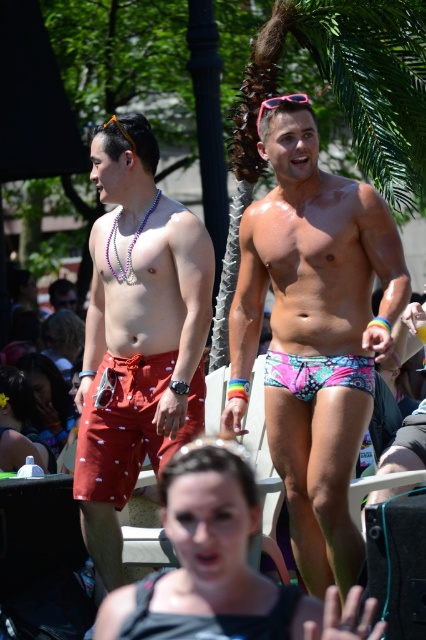
You are standing at the point with coordinates point (20,392) and want to walk to the point with coordinates point (184,625). Based on the spatial relationship between these two points, will you need to walk forward or backward to reach your destination?

You need to walk forward to reach point (184,625) because it is in front of point (20,392).

You are a photographer at the event and want to capture a photo that includes both the green leafy palm tree at upper center and the matte white bottle at lower left. Based on their positions, will the palm tree appear in front of or behind the matte white bottle in the photo?

The green leafy palm tree at upper center is positioned over matte white bottle at lower left, so it will appear in front of the matte white bottle in the photo.

You are at a beach party and want to grab a drink. You see a matte black bikini top at lower center and a matte white bottle at lower left. Which object is closer to your left side?

The matte white bottle at lower left is closer to your left side because it is positioned to the left of the matte black bikini top at lower center.